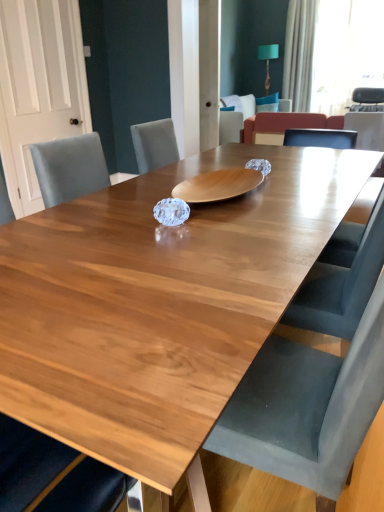
Question: Is white sheer curtain at upper right wider or thinner than wooden table at center?

Choices:
 (A) wide
 (B) thin

Answer: (B)

Question: In the image, is white sheer curtain at upper right positioned in front of or behind wooden table at center?

Choices:
 (A) front
 (B) behind

Answer: (B)

Question: Which is farther from the white sheer curtain at upper right?

Choices:
 (A) wooden table at center
 (B) velvet armchair at upper right, acting as the 1th armchair starting from the right
 (C) velvet armchair at center, the 1th armchair from the left
 (D) white fabric curtain at upper right

Answer: (A)

Question: Which object is the closest to the velvet armchair at upper right, acting as the 1th armchair starting from the right?

Choices:
 (A) white sheer curtain at upper right
 (B) velvet armchair at center, the 1th armchair from the left
 (C) wooden table at center
 (D) white fabric curtain at upper right

Answer: (A)